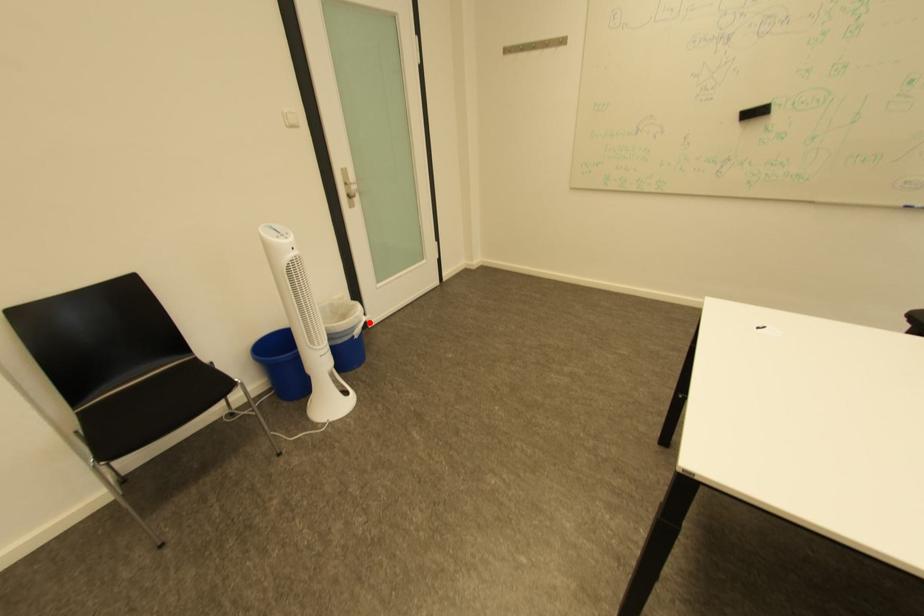
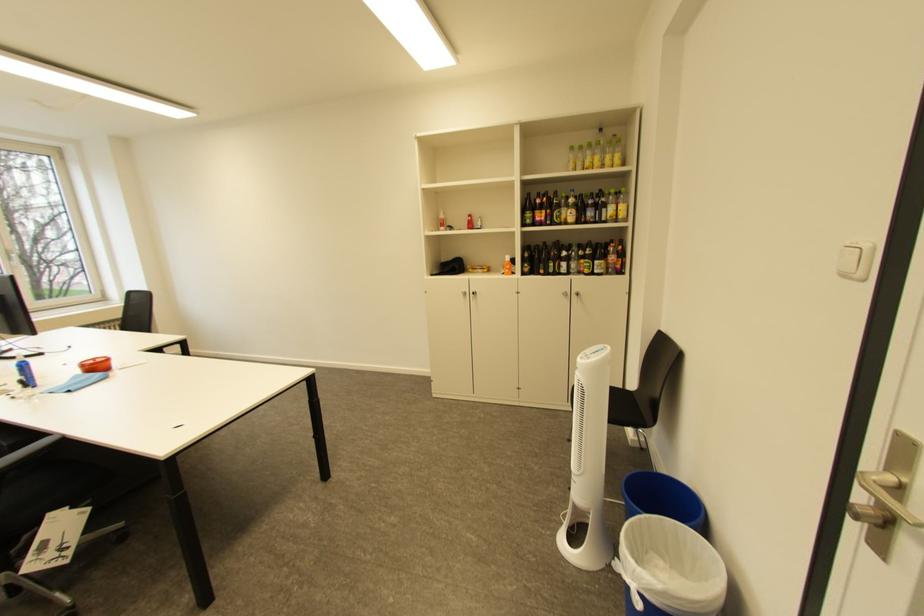
Question: I am providing you with two images of the same scene from different viewpoints. A red point is shown in image1. For the corresponding object point in image2, is it positioned nearer or farther from the camera?

Choices:
 (A) Nearer
 (B) Farther

Answer: (B)